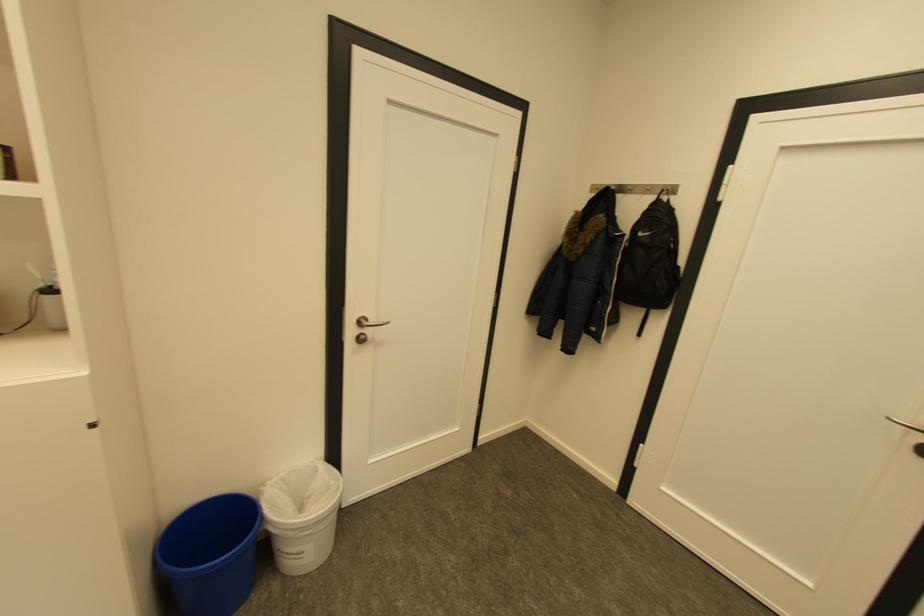
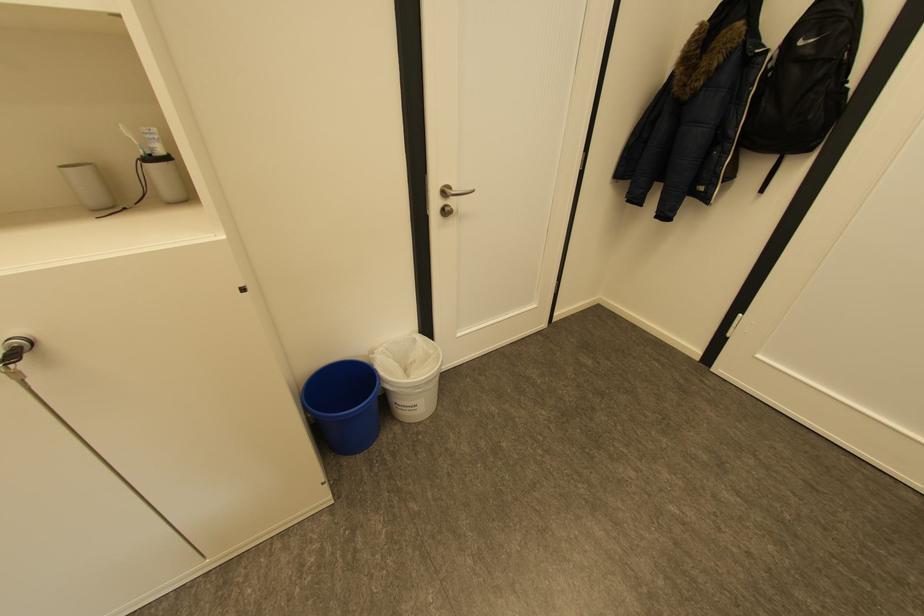
Find the pixel in the second image that matches (x=289, y=477) in the first image.

(394, 349)